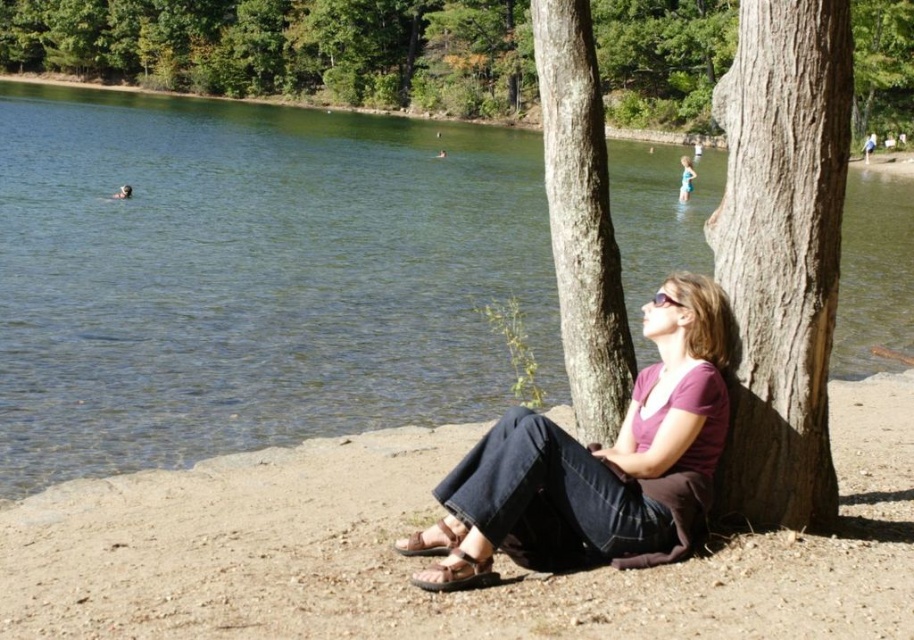
Can you confirm if brown dirt shoreline at lower left is positioned below smooth brown tree trunk at center?

Yes, brown dirt shoreline at lower left is below smooth brown tree trunk at center.

Does brown dirt shoreline at lower left appear on the right side of smooth brown tree trunk at center?

Yes, brown dirt shoreline at lower left is to the right of smooth brown tree trunk at center.

Which is behind, point (220, 467) or point (805, 449)?

The point (220, 467) is more distant.

Locate an element on the screen. This screenshot has width=914, height=640. brown dirt shoreline at lower left is located at coordinates (422, 557).

Can you confirm if green water at lake center is taller than light blue swimsuit at center?

Correct, green water at lake center is much taller as light blue swimsuit at center.

Can you confirm if green water at lake center is shorter than light blue swimsuit at center?

No.

Between point (160, 134) and point (688, 188), which one is positioned behind?

Positioned behind is point (160, 134).

Locate an element on the screen. green water at lake center is located at coordinates (251, 276).

Which is in front, point (736, 282) or point (548, 140)?

Positioned in front is point (736, 282).

How much distance is there between smooth brown tree trunk at center and smooth brown bark at center?

1.86 meters

Between point (837, 81) and point (585, 380), which one is positioned in front?

Point (837, 81)

I want to click on smooth brown tree trunk at center, so click(781, 253).